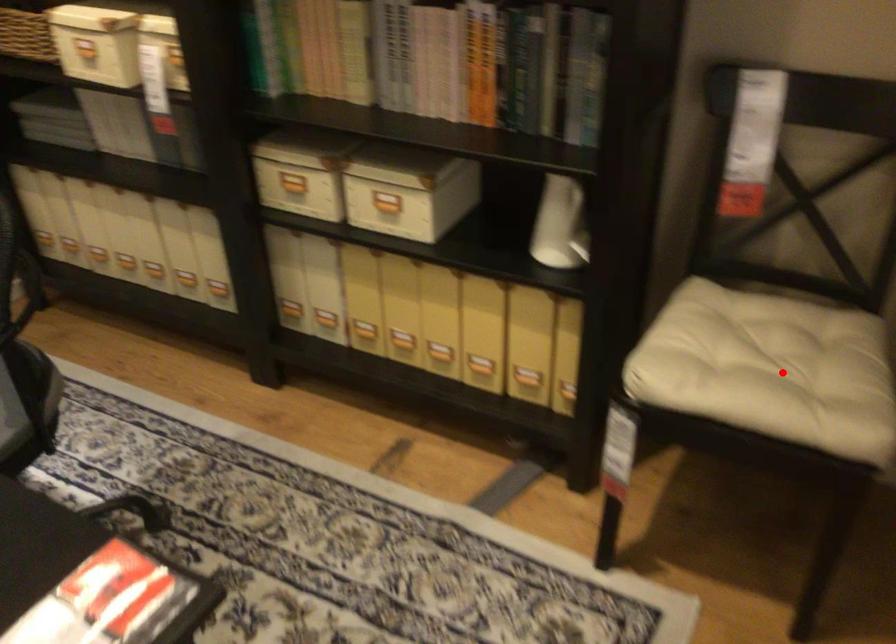
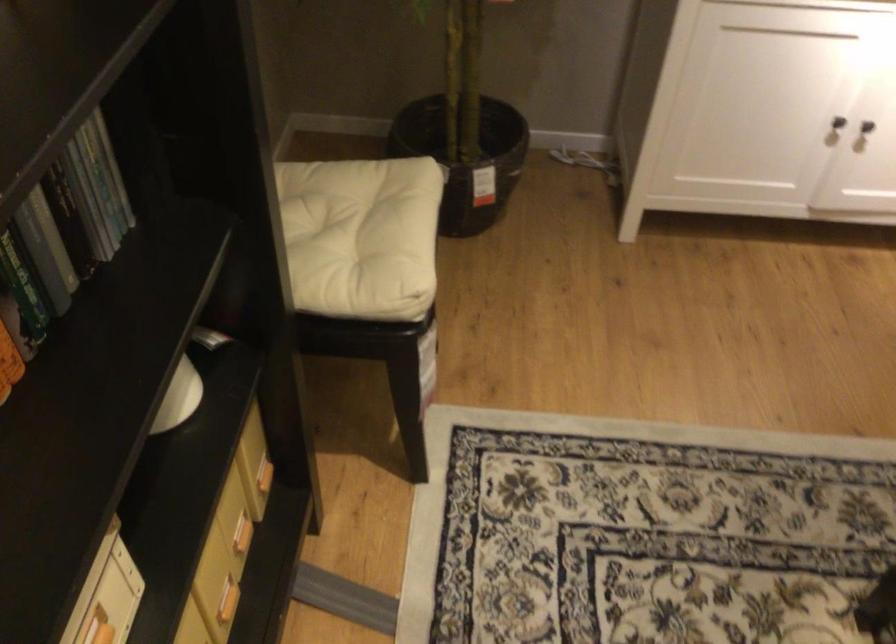
Find the pixel in the second image that matches the highlighted location in the first image.

(355, 234)